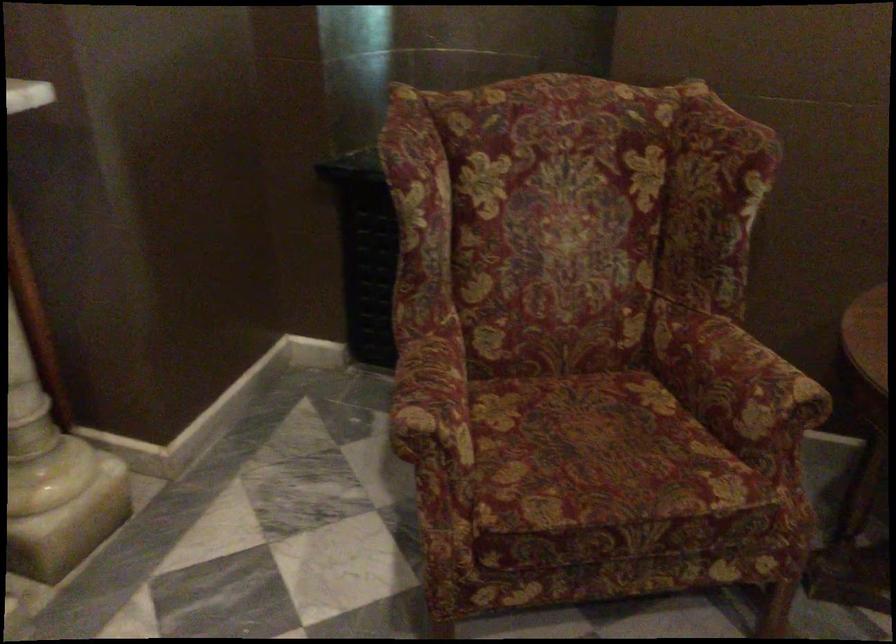
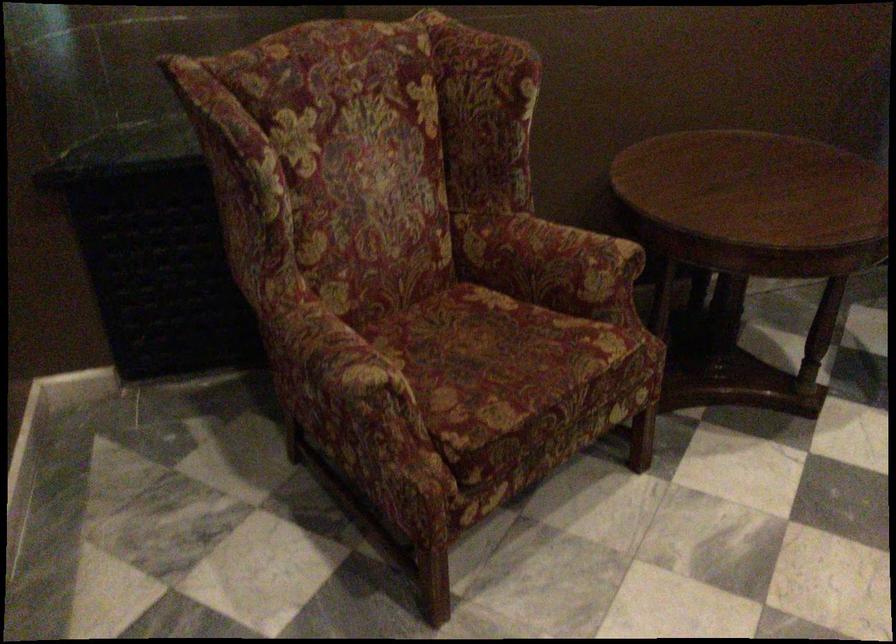
The point at (x=588, y=460) is marked in the first image. Where is the corresponding point in the second image?

(495, 363)